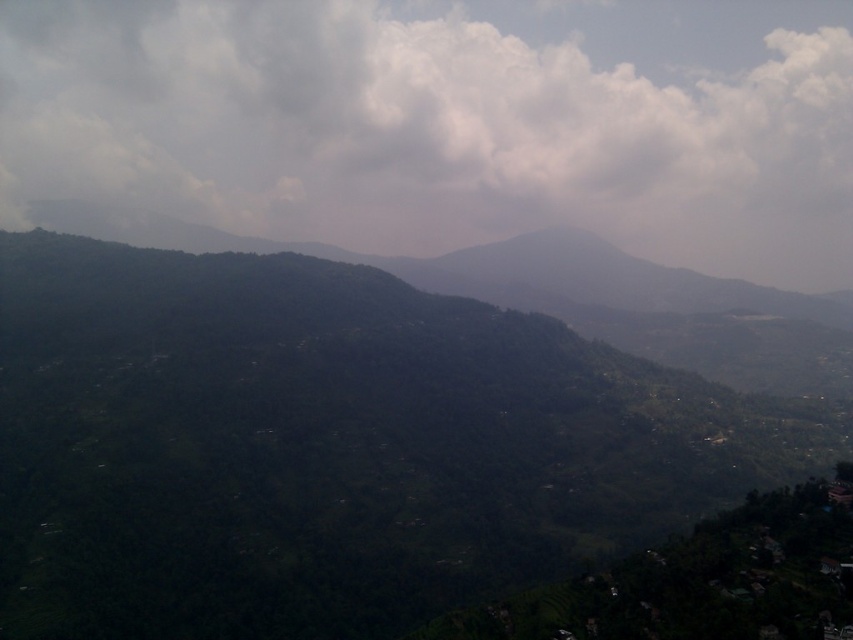
You are a hiker planning to take a photo of the green leafy mountain at center and the white fluffy cloud at upper center. Which object appears larger in the frame?

The white fluffy cloud at upper center appears larger in the frame because it is bigger than the green leafy mountain at center.

Looking at this image, you are a hiker planning to climb the green leafy mountain at center. You notice a white fluffy cloud at upper center above you. If you want to reach the cloud, how much vertical distance do you need to climb?

The green leafy mountain at center and white fluffy cloud at upper center are 455.22 meters apart from each other. However, clouds are not physical objects to climb, so you cannot reach the white fluffy cloud at upper center by climbing the mountain.

You are standing at the origin point in the image. Based on the coordinates provided, in which direction should you move to reach the green leafy mountain at center?

The green leafy mountain at center is located at coordinates point [329,445]. Since the origin is at the bottom left corner of the image, moving towards the upper right direction would lead you to the green leafy mountain at center.